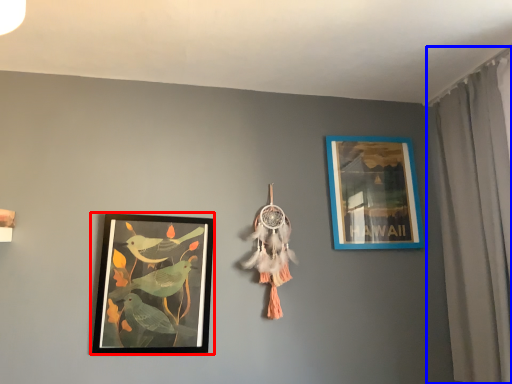
Question: Which of the following is the closest to the observer, picture frame (highlighted by a red box) or curtain (highlighted by a blue box)?

Choices:
 (A) picture frame
 (B) curtain

Answer: (B)